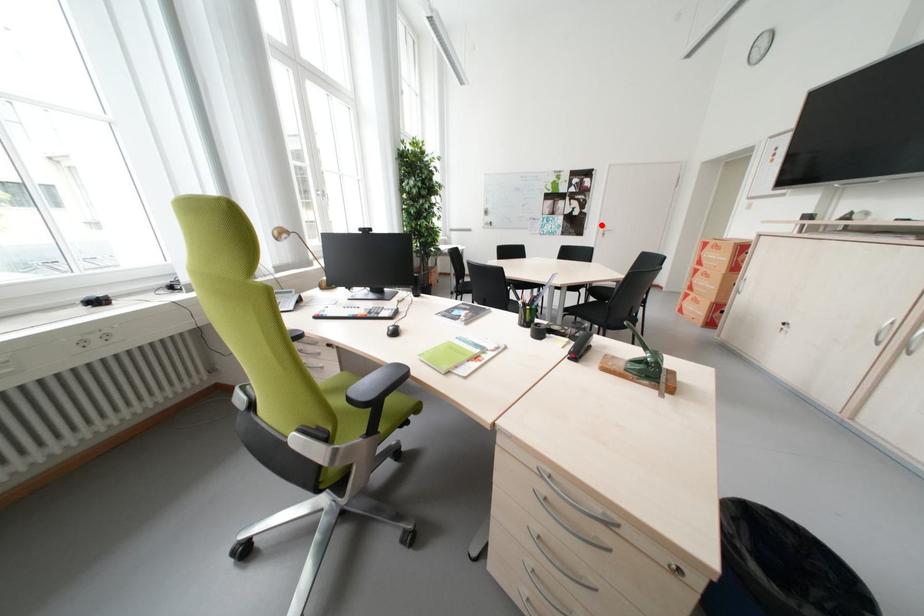
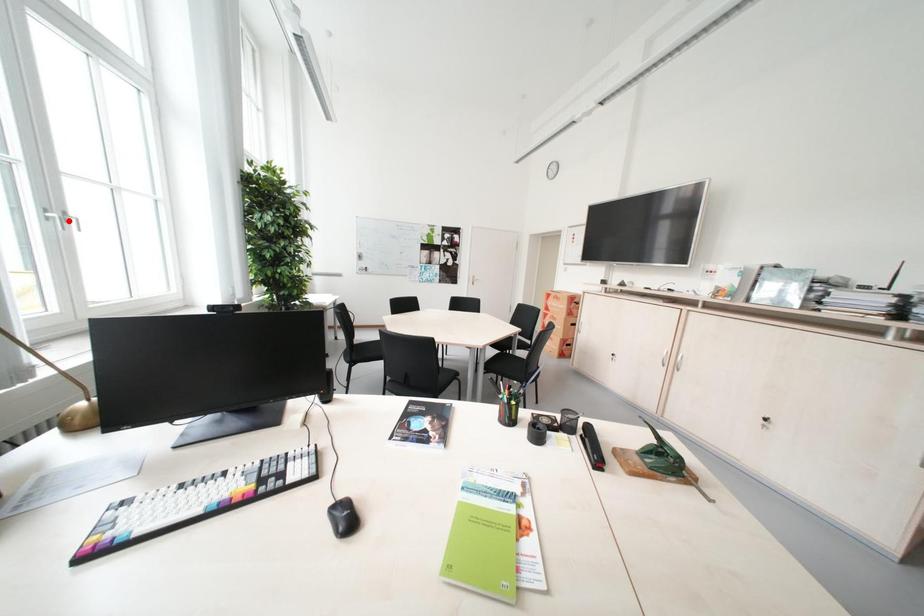
I am providing you with two images of the same scene from different viewpoints. A red point is marked on the first image and another point is marked on the second image. Are the points marked in image1 and image2 representing the same 3D position?

No